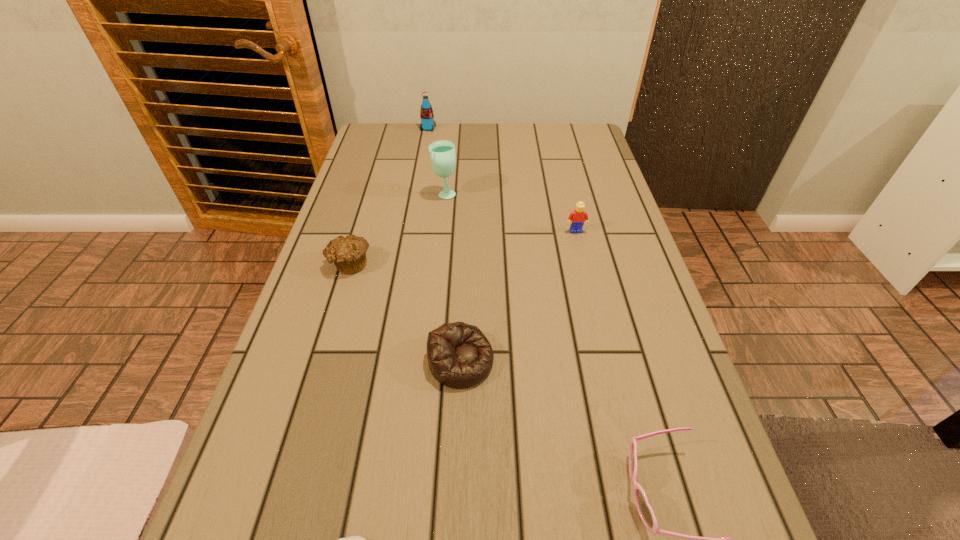
At what (x,y) coordinates should I click in order to perform the action: click on free space at the far left corner. Please return your answer as a coordinate pair (x, y). Looking at the image, I should click on (402, 123).

Identify the location of vacant space at the far right corner. (568, 156).

I want to click on free space between the tallest object and the leftmost object, so click(x=397, y=228).

Where is `free point between the beanbag and the sixth shortest object`? free point between the beanbag and the sixth shortest object is located at coordinates (444, 245).

Image resolution: width=960 pixels, height=540 pixels. In order to click on unoccupied position between the leftmost object and the glass in this screenshot , I will do `click(397, 228)`.

Identify the location of vacant area that lies between the muffin and the soda. (389, 196).

Find the location of a particular element. This screenshot has width=960, height=540. object that stands as the second closest to the fifth nearest object is located at coordinates (459, 355).

Locate which object is the fifth closest to the leftmost object. Please provide its 2D coordinates. Your answer should be formatted as a tuple, i.e. [(x, y)], where the tuple contains the x and y coordinates of a point satisfying the conditions above.

[(426, 113)]

The image size is (960, 540). Identify the location of free point that satisfies the following two spatial constraints: 1. on the front side of the fifth farthest object; 2. on the right side of the leftmost object. (320, 361).